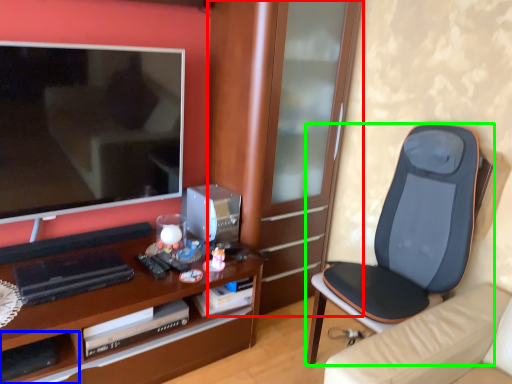
Question: Estimate the real-world distances between objects in this image. Which object is farther from cabinetry (highlighted by a red box), shelf (highlighted by a blue box) or chair (highlighted by a green box)?

Choices:
 (A) shelf
 (B) chair

Answer: (A)